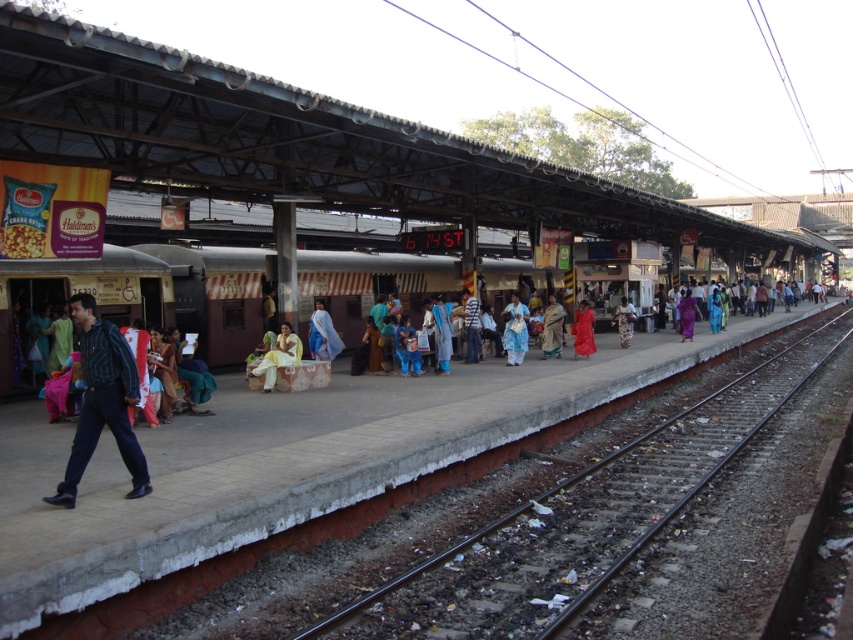
Who is more forward, (88, 387) or (323, 328)?

Point (88, 387) is in front.

Based on the photo, does blue striped shirt at center appear on the right side of light blue fabric at center?

No, blue striped shirt at center is not to the right of light blue fabric at center.

Identify the location of blue striped shirt at center. This screenshot has height=640, width=853. (102, 401).

Is blue striped shirt at center thinner than matte red dress at center?

Yes.

Does blue striped shirt at center come behind matte red dress at center?

No, blue striped shirt at center is in front of matte red dress at center.

The image size is (853, 640). Identify the location of blue striped shirt at center. (102, 401).

Between purple silk saree at center and white cotton dress at center, which one has more height?

purple silk saree at center is taller.

Who is shorter, purple silk saree at center or white cotton dress at center?

Standing shorter between the two is white cotton dress at center.

Where is `purple silk saree at center`? purple silk saree at center is located at coordinates (688, 314).